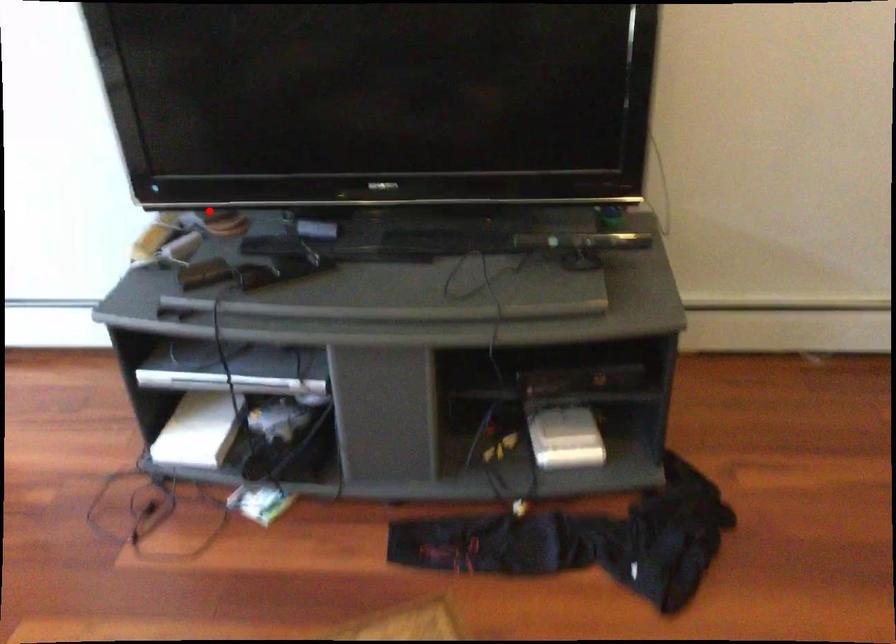
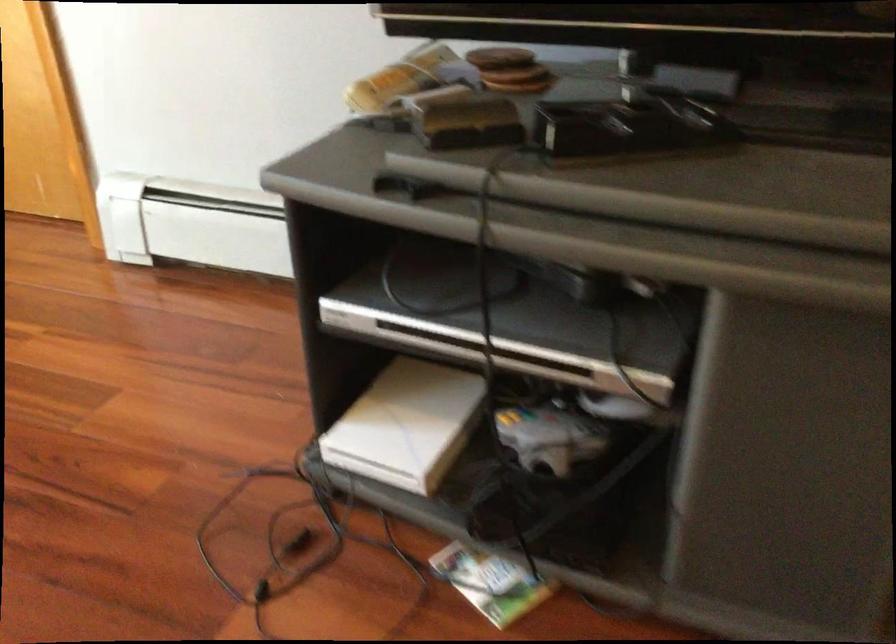
Question: I am providing you with two images of the same scene from different viewpoints. Image1 has a red point marked. In image2, the corresponding 3D location appears at what relative position? Reply with the corresponding letter.

Choices:
 (A) Closer
 (B) Farther

Answer: (A)